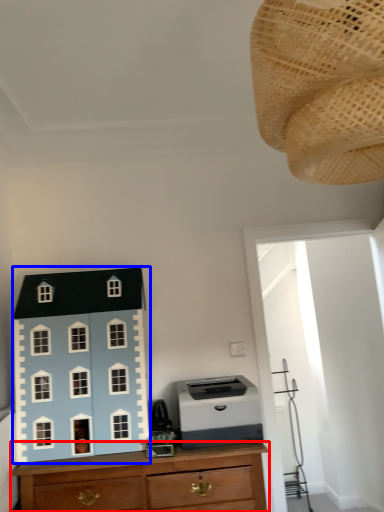
Question: Among these objects, which one is farthest to the camera, chest of drawers (highlighted by a red box) or toy (highlighted by a blue box)?

Choices:
 (A) chest of drawers
 (B) toy

Answer: (B)